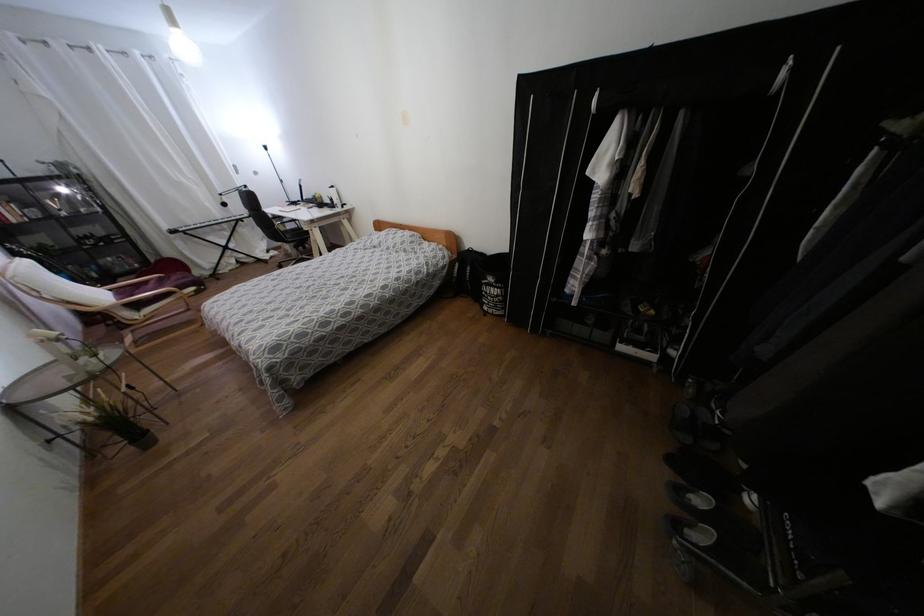
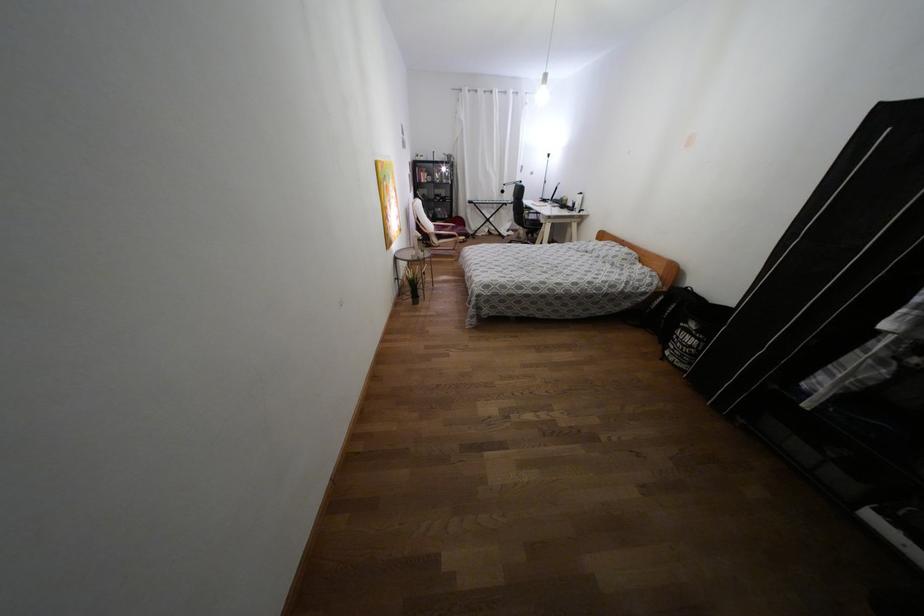
Find the pixel in the second image that matches [138,436] in the first image.

(415, 296)